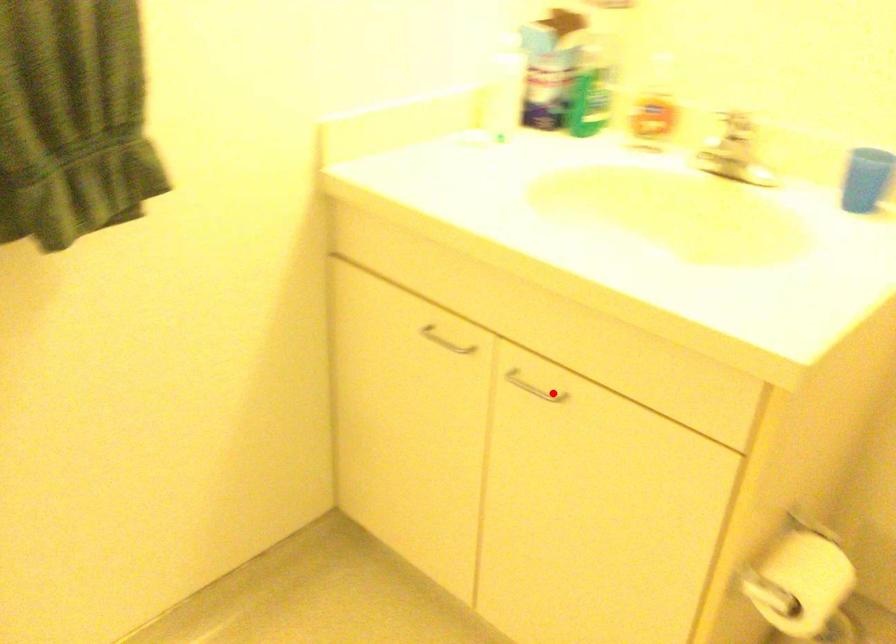
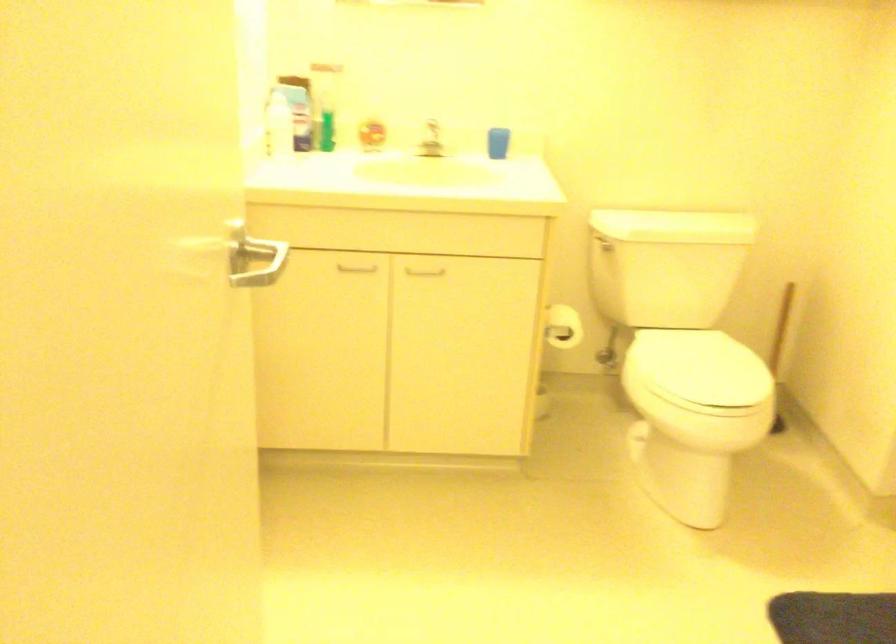
In the second image, find the point that corresponds to the highlighted location in the first image.

(424, 272)